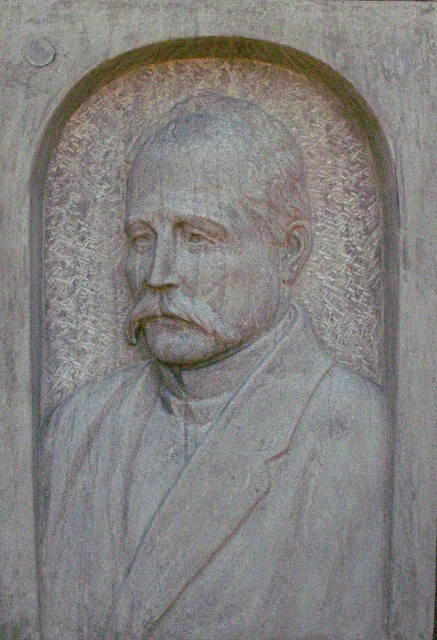
Based on the scene description, which object is wider between the gray stone bust at center and the gray stone face at center?

The gray stone bust at center is wider than the gray stone face at center according to the description.

You are an art conservator examining the gray stone bust at center and the gray stone face at center in the bas relief sculpture. Which object is located lower in the image?

The gray stone bust at center is positioned under the gray stone face at center, so it is located lower in the image.